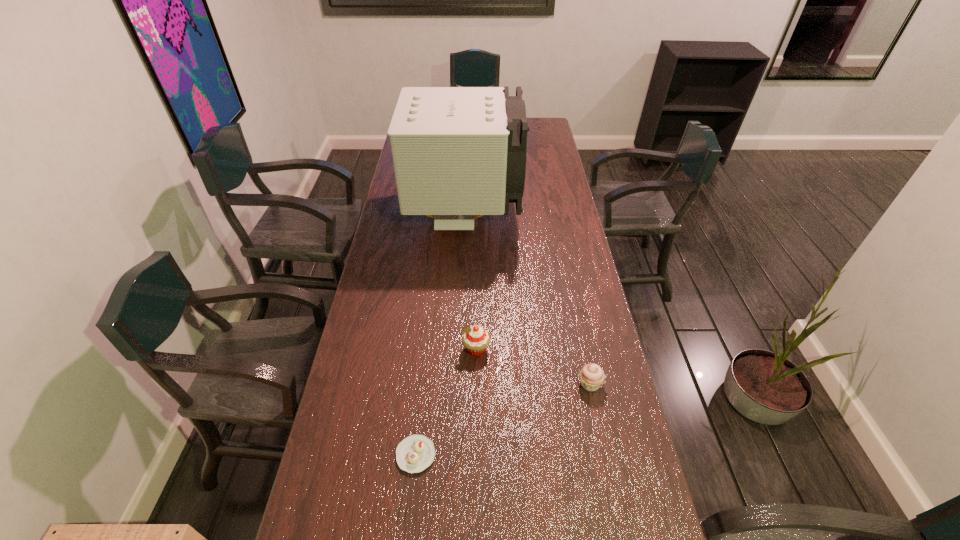
Image resolution: width=960 pixels, height=540 pixels. I want to click on vacant region that satisfies the following two spatial constraints: 1. on the back side of the leftmost cupcake; 2. on the right side of the third tallest object, so click(x=423, y=384).

The width and height of the screenshot is (960, 540). Identify the location of free point that satisfies the following two spatial constraints: 1. on the back side of the second farthest cupcake; 2. on the left side of the shortest cupcake. (423, 384).